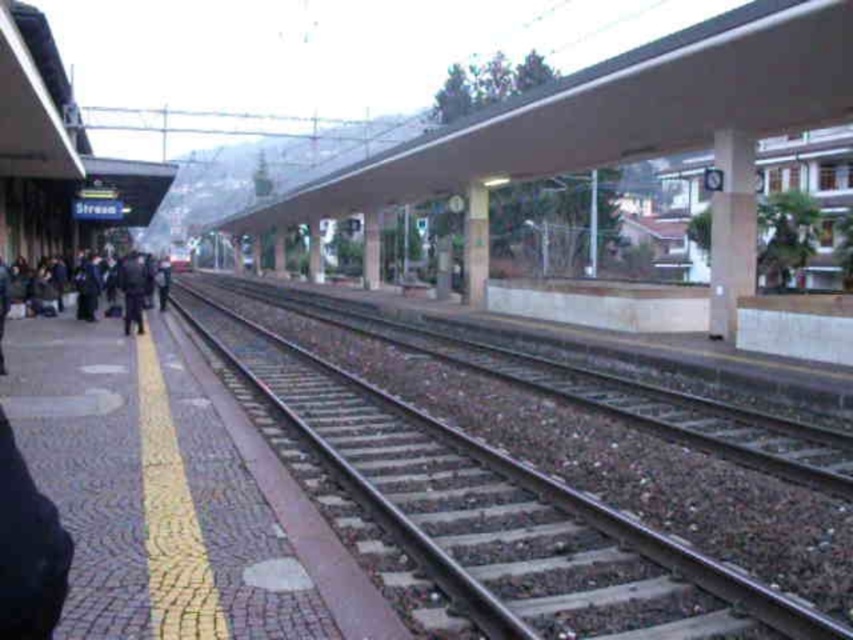
You are a visually impaired person standing on the platform and want to move from the concrete pillar at center to the dark blue uniform at center. The tactile paving strip is 1.2 meters wide. Can you safely walk between them without crossing the tactile strip?

The distance between the concrete pillar at center and dark blue uniform at center is 16.27 meters. Since the tactile strip is only 1.2 meters wide, you can safely walk between them while staying within the platform area away from the strip.